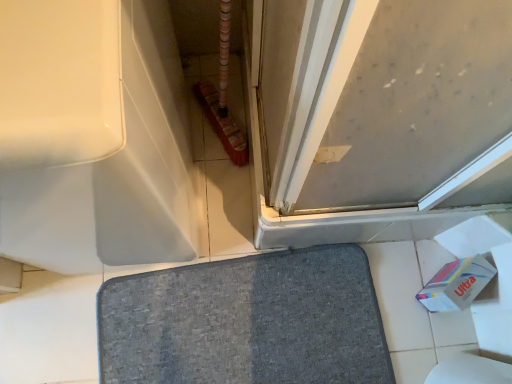
Question: Is white glossy bathtub at upper left facing towards white cardboard toilet paper at lower right?

Choices:
 (A) no
 (B) yes

Answer: (A)

Question: From a real-world perspective, is white glossy bathtub at upper left below white cardboard toilet paper at lower right?

Choices:
 (A) yes
 (B) no

Answer: (B)

Question: Considering the relative sizes of white glossy bathtub at upper left and white cardboard toilet paper at lower right in the image provided, is white glossy bathtub at upper left bigger than white cardboard toilet paper at lower right?

Choices:
 (A) yes
 (B) no

Answer: (A)

Question: Is white cardboard toilet paper at lower right surrounded by white glossy bathtub at upper left?

Choices:
 (A) yes
 (B) no

Answer: (B)

Question: Is white glossy bathtub at upper left wider than white cardboard toilet paper at lower right?

Choices:
 (A) yes
 (B) no

Answer: (A)

Question: Is white glossy bathtub at upper left closer to the viewer compared to white cardboard toilet paper at lower right?

Choices:
 (A) no
 (B) yes

Answer: (B)

Question: From the image's perspective, is white cardboard toilet paper at lower right on top of gray fabric bath mat at center?

Choices:
 (A) yes
 (B) no

Answer: (A)

Question: Considering the relative sizes of white cardboard toilet paper at lower right and gray fabric bath mat at center in the image provided, is white cardboard toilet paper at lower right wider than gray fabric bath mat at center?

Choices:
 (A) no
 (B) yes

Answer: (A)

Question: Can you confirm if white cardboard toilet paper at lower right is positioned to the left of gray fabric bath mat at center?

Choices:
 (A) yes
 (B) no

Answer: (B)

Question: Would you say white cardboard toilet paper at lower right is a long distance from gray fabric bath mat at center?

Choices:
 (A) yes
 (B) no

Answer: (B)

Question: From a real-world perspective, is white cardboard toilet paper at lower right physically below gray fabric bath mat at center?

Choices:
 (A) no
 (B) yes

Answer: (A)

Question: Is white cardboard toilet paper at lower right thinner than gray fabric bath mat at center?

Choices:
 (A) no
 (B) yes

Answer: (B)

Question: Can you confirm if white cardboard toilet paper at lower right is shorter than matte gray screen door at upper right?

Choices:
 (A) yes
 (B) no

Answer: (A)